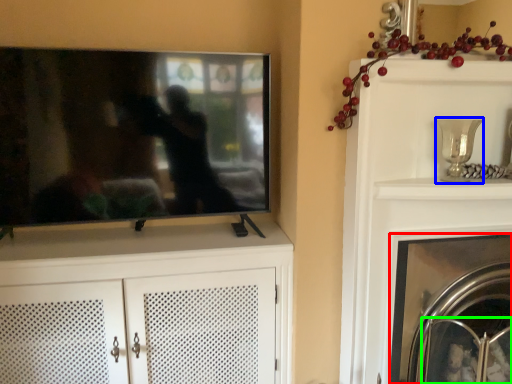
Question: Estimate the real-world distances between objects in this image. Which object is closer to fireplace (highlighted by a red box), candle holder (highlighted by a blue box) or glass door (highlighted by a green box)?

Choices:
 (A) candle holder
 (B) glass door

Answer: (B)